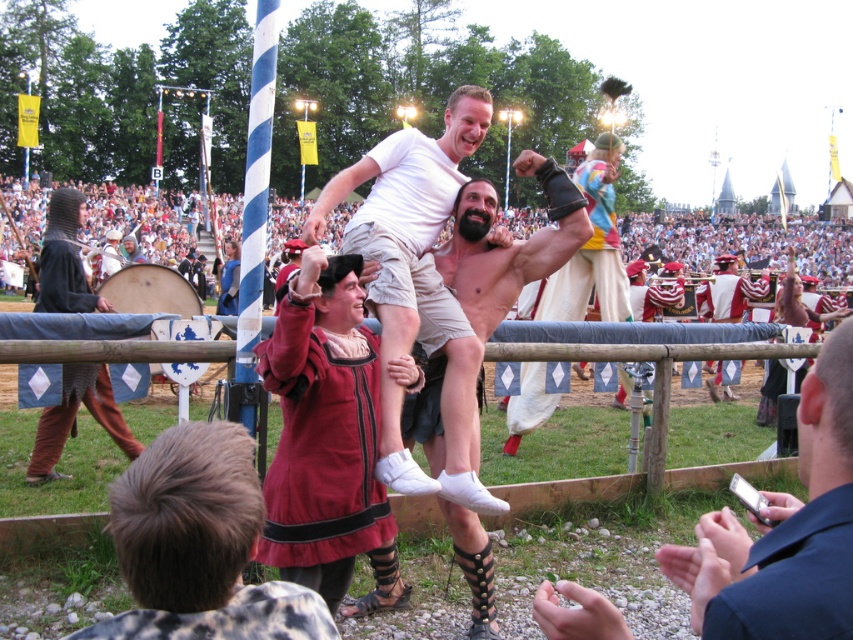
You are a costume designer preparing for a play. You have two props, the shiny metallic helmet at center and the dark brown leather boots at lower center. Which prop requires more storage space due to its size?

The shiny metallic helmet at center requires more storage space because it has a larger size compared to the dark brown leather boots at lower center.

You are a photographer at the medieval event. You want to take a photo of the dark red velvet robe at lower right without including the crowd in the background. Since the robe is 9.78 feet away, what is the minimum distance you should set your camera lens to focus on to ensure the robe is in sharp focus?

The minimum distance you should set your camera lens to focus on is 9.78 feet to ensure the dark red velvet robe at lower right is in sharp focus.